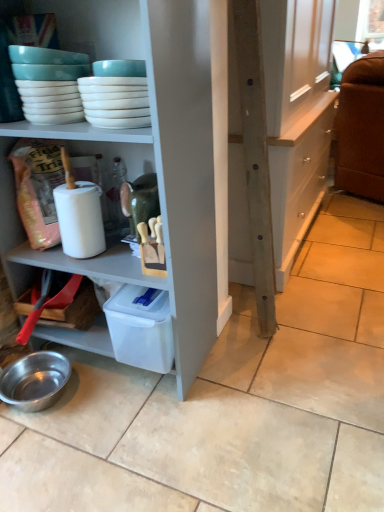
Question: Is shiny metallic bowl at lower left inside the boundaries of wooden cabinet at center, or outside?

Choices:
 (A) inside
 (B) outside

Answer: (B)

Question: From their relative heights in the image, would you say shiny metallic bowl at lower left is taller or shorter than wooden cabinet at center?

Choices:
 (A) tall
 (B) short

Answer: (B)

Question: Which object is positioned farthest from the wooden cabinet at center?

Choices:
 (A) shiny metallic bowl at lower left
 (B) white glossy bowls at upper left

Answer: (A)

Question: Estimate the real-world distances between objects in this image. Which object is closer to the white glossy bowls at upper left?

Choices:
 (A) shiny metallic bowl at lower left
 (B) wooden cabinet at center

Answer: (A)